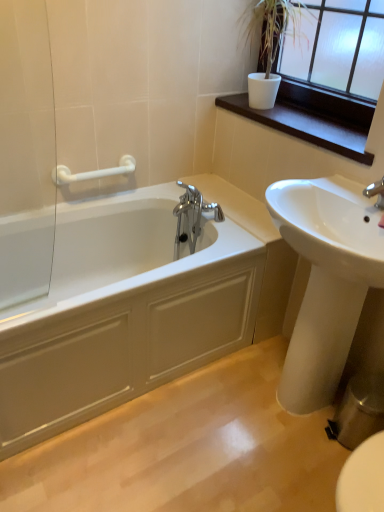
This screenshot has height=512, width=384. In order to click on free spot below dark brown wood at upper right (from a real-world perspective) in this screenshot , I will do `click(327, 124)`.